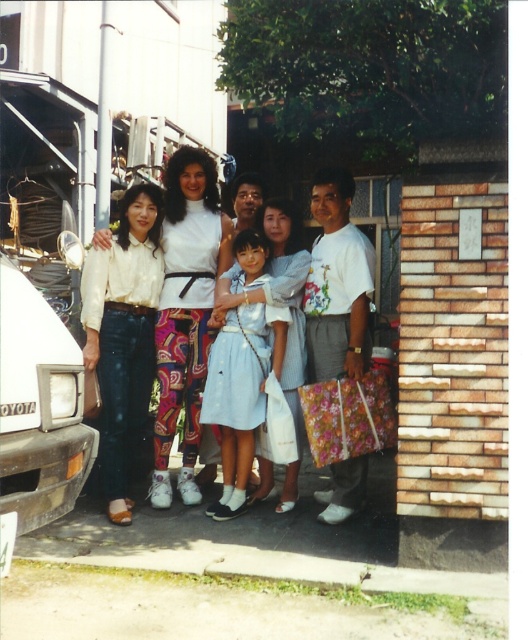
Question: Which object is closer to the camera taking this photo?

Choices:
 (A) black matte van at left
 (B) light blue fabric dress at center
 (C) light blue denim dress at center

Answer: (A)

Question: Estimate the real-world distances between objects in this image. Which object is farther from the light blue denim dress at center?

Choices:
 (A) black matte van at left
 (B) light blue fabric dress at center
 (C) white matte blouse at center

Answer: (A)

Question: Which point appears farthest from the camera in this image?

Choices:
 (A) (5, 355)
 (B) (315, 348)
 (C) (250, 360)

Answer: (B)

Question: Is black matte van at left above light blue fabric dress at center?

Choices:
 (A) no
 (B) yes

Answer: (B)

Question: Is black matte van at left to the right of light blue denim dress at center from the viewer's perspective?

Choices:
 (A) yes
 (B) no

Answer: (B)

Question: Where is black matte van at left located in relation to light blue fabric dress at center in the image?

Choices:
 (A) left
 (B) right

Answer: (A)